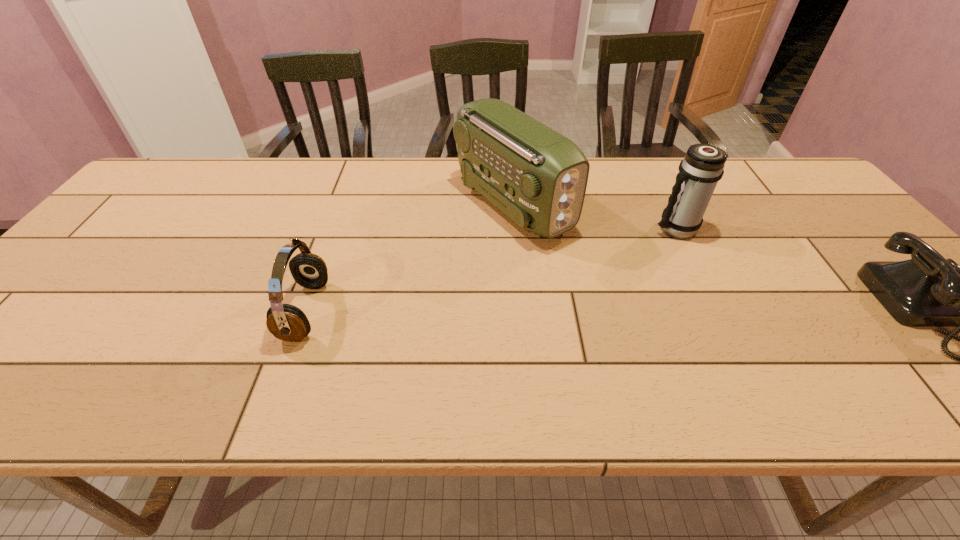
The height and width of the screenshot is (540, 960). What are the coordinates of `blank region between the second object from left to right and the headset` in the screenshot? It's located at (409, 258).

What are the coordinates of `vacant area that lies between the second object from right to left and the third object from right to left` in the screenshot? It's located at tap(593, 217).

The image size is (960, 540). Find the location of `free space between the third tallest object and the radio_receiver`. free space between the third tallest object and the radio_receiver is located at coordinates (409, 258).

Identify which object is the second nearest to the leftmost object. Please provide its 2D coordinates. Your answer should be formatted as a tuple, i.e. [(x, y)], where the tuple contains the x and y coordinates of a point satisfying the conditions above.

[(703, 165)]

Where is `object that is the third closest to the third object from right to left`? The image size is (960, 540). object that is the third closest to the third object from right to left is located at coordinates (927, 290).

The height and width of the screenshot is (540, 960). Find the location of `free space that satisfies the following two spatial constraints: 1. on the front side of the second object from right to left; 2. on the left side of the radio_receiver`. free space that satisfies the following two spatial constraints: 1. on the front side of the second object from right to left; 2. on the left side of the radio_receiver is located at coordinates (515, 228).